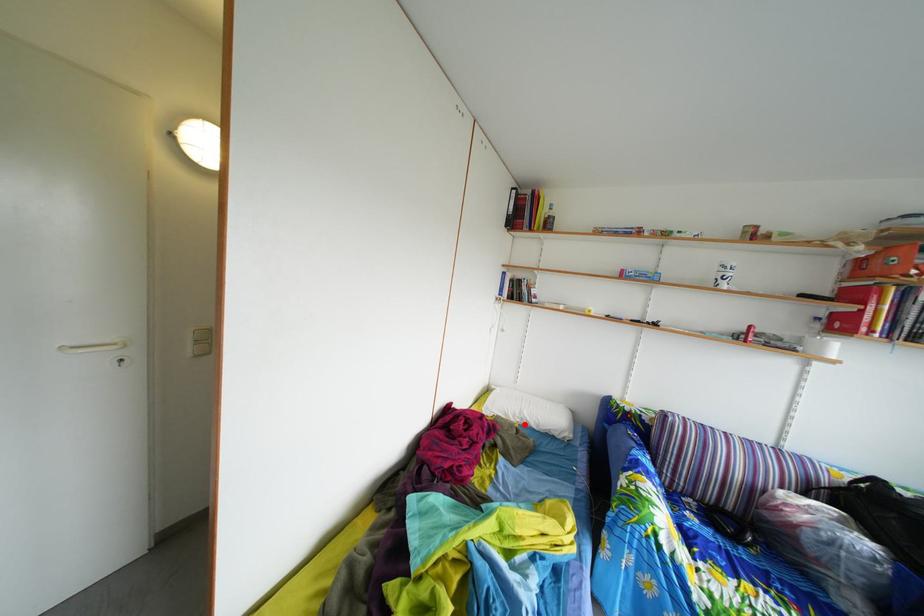
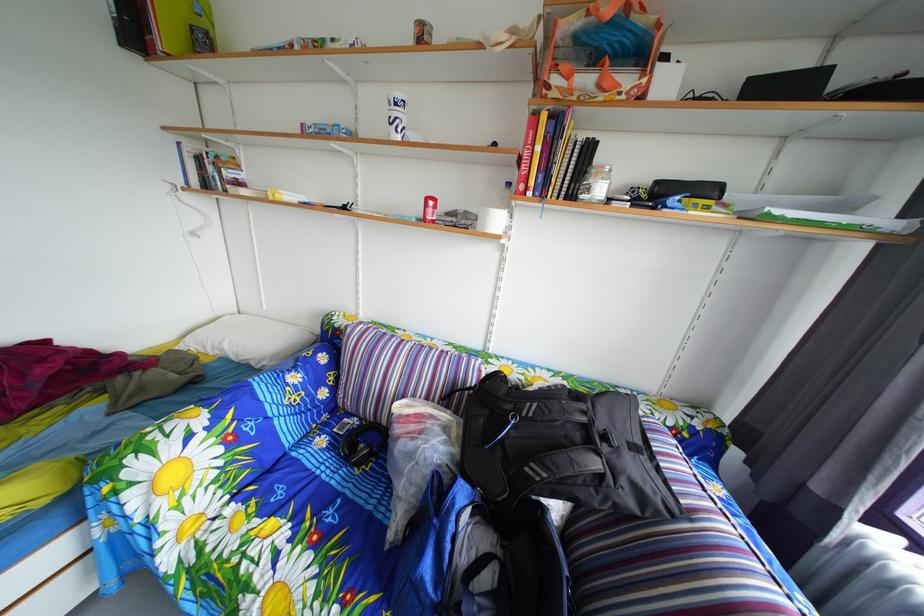
Locate, in the second image, the point that corresponds to the highlighted location in the first image.

(224, 357)